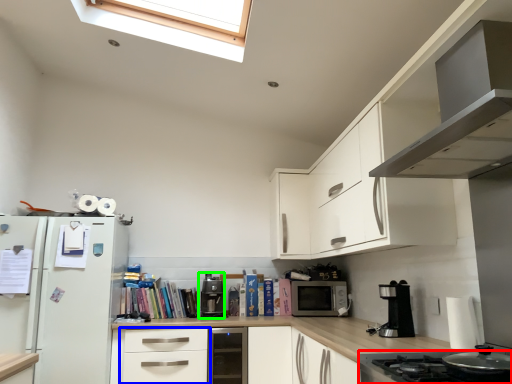
Question: Considering the real-world distances, which object is farthest from home appliance (highlighted by a red box)? drawer (highlighted by a blue box) or coffee machine (highlighted by a green box)?

Choices:
 (A) drawer
 (B) coffee machine

Answer: (B)